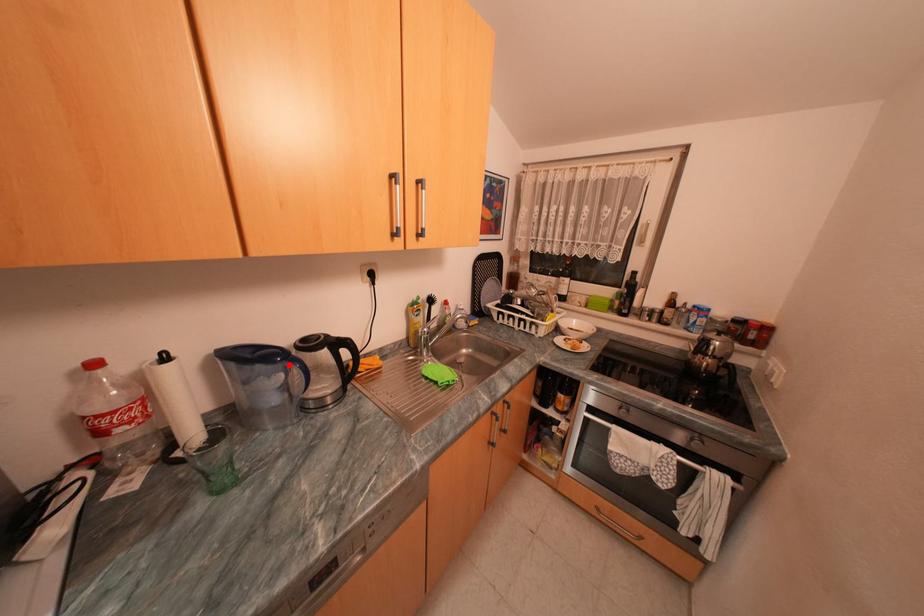
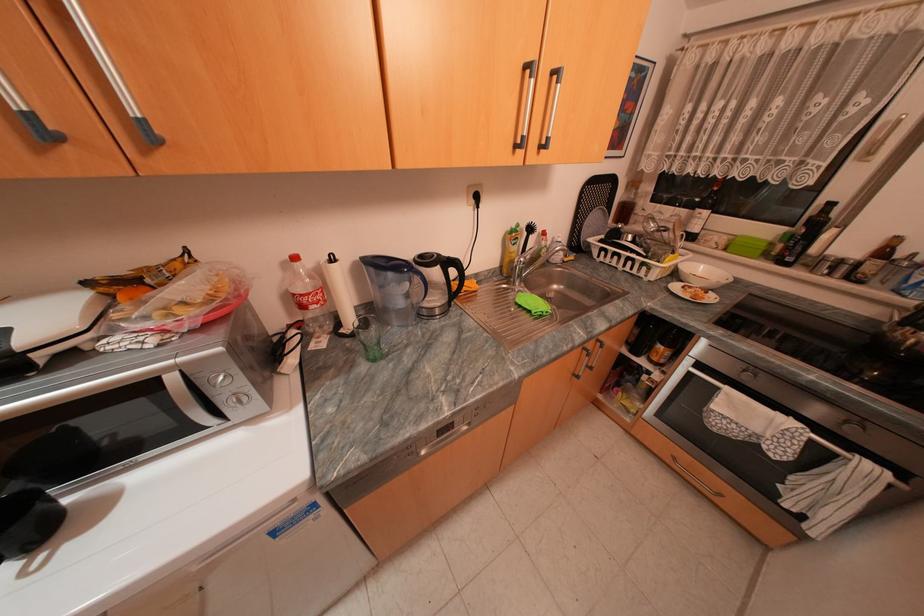
The point at the highlighted location is marked in the first image. Where is the corresponding point in the second image?

(416, 275)